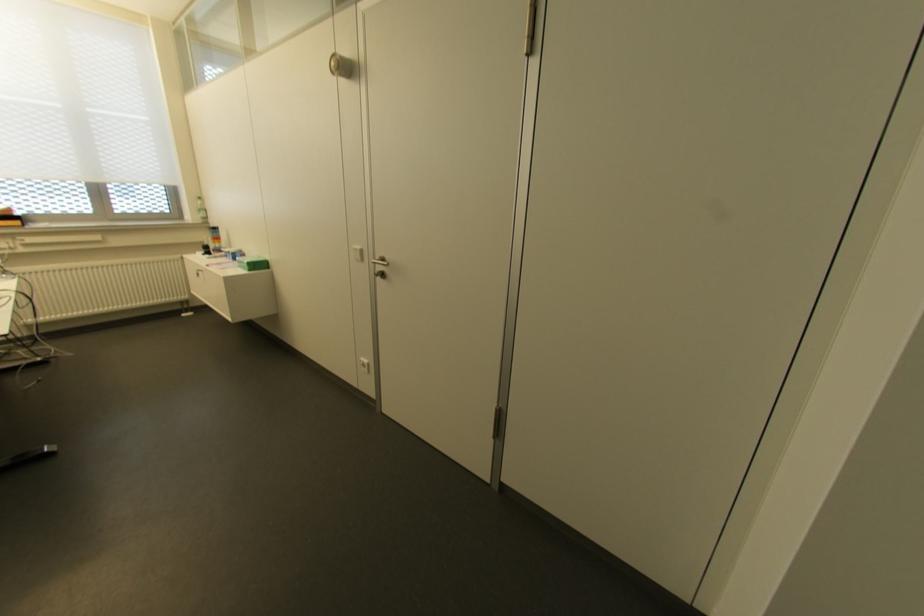
The height and width of the screenshot is (616, 924). Describe the element at coordinates (358, 253) in the screenshot. I see `the white light switch` at that location.